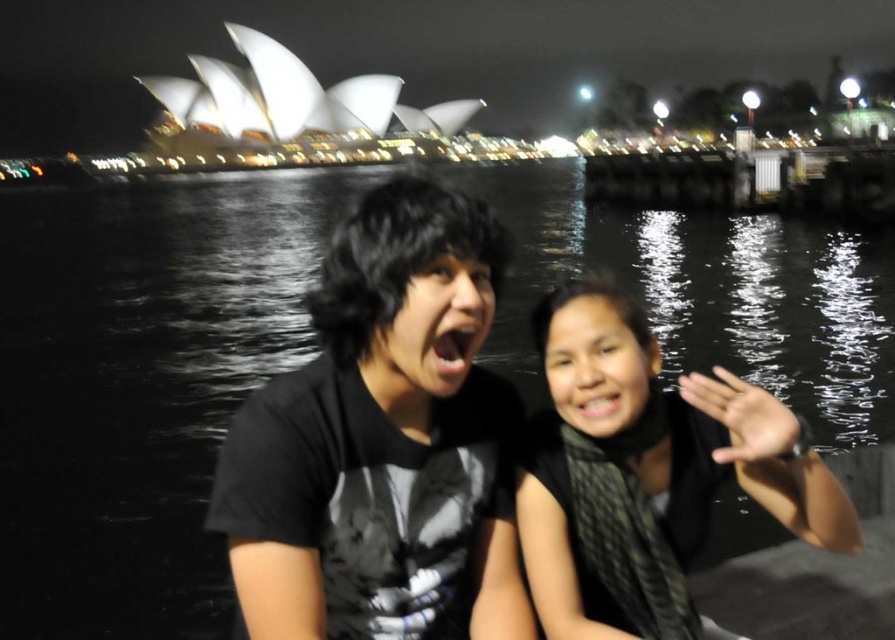
Question: Which object appears farthest from the camera in this image?

Choices:
 (A) black matte shirt at center
 (B) black silk scarf at lower right

Answer: (B)

Question: Can you confirm if black matte shirt at center is positioned below black silk scarf at lower right?

Choices:
 (A) yes
 (B) no

Answer: (B)

Question: Is black matte shirt at center positioned behind black silk scarf at lower right?

Choices:
 (A) no
 (B) yes

Answer: (A)

Question: Is black matte shirt at center positioned in front of black silk scarf at lower right?

Choices:
 (A) yes
 (B) no

Answer: (A)

Question: Which of the following is the farthest from the observer?

Choices:
 (A) black silk scarf at lower right
 (B) black matte shirt at center

Answer: (A)